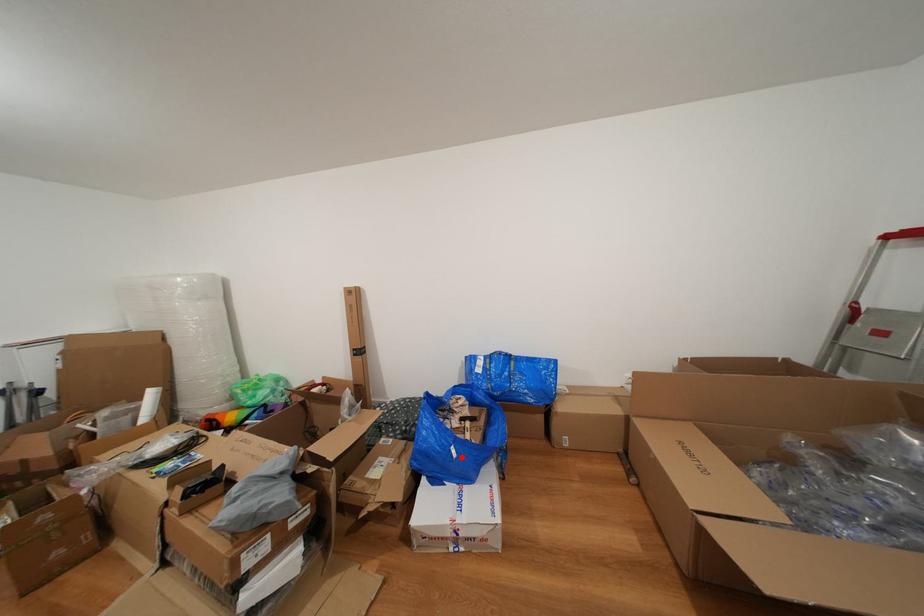
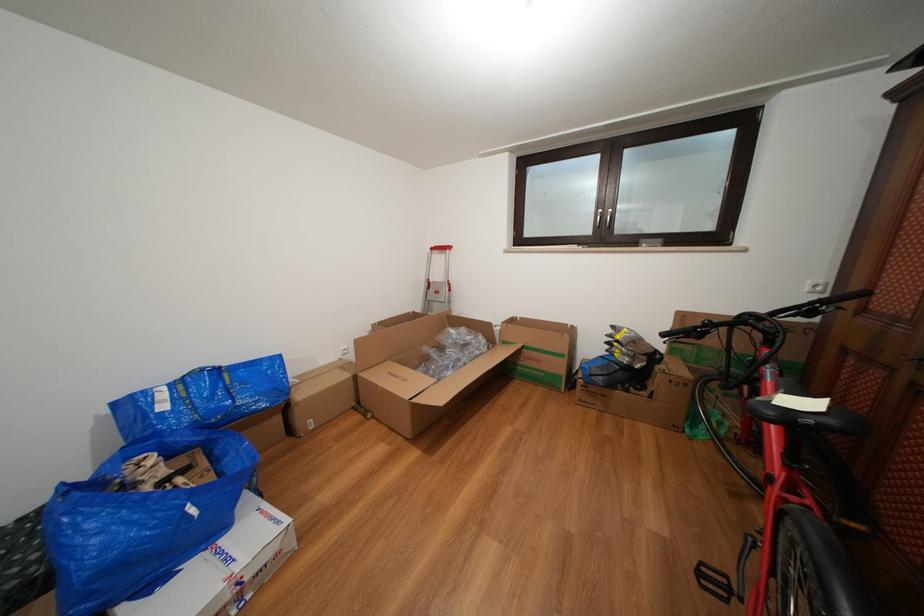
Question: I am providing you with two images of the same scene from different viewpoints. Image1 has a red point marked. In image2, the corresponding 3D location appears at what relative position? Reply with the corresponding letter.

Choices:
 (A) Closer
 (B) Farther

Answer: (B)